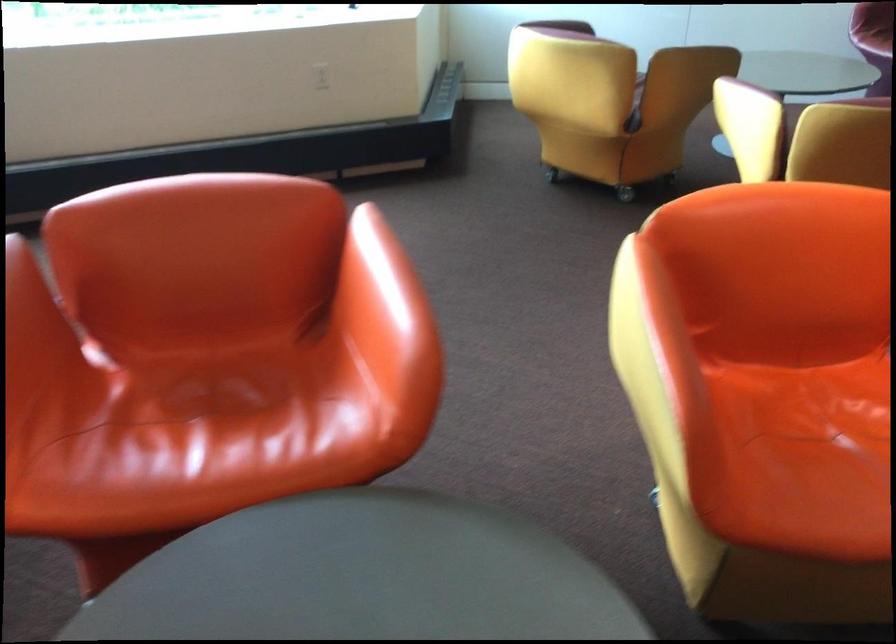
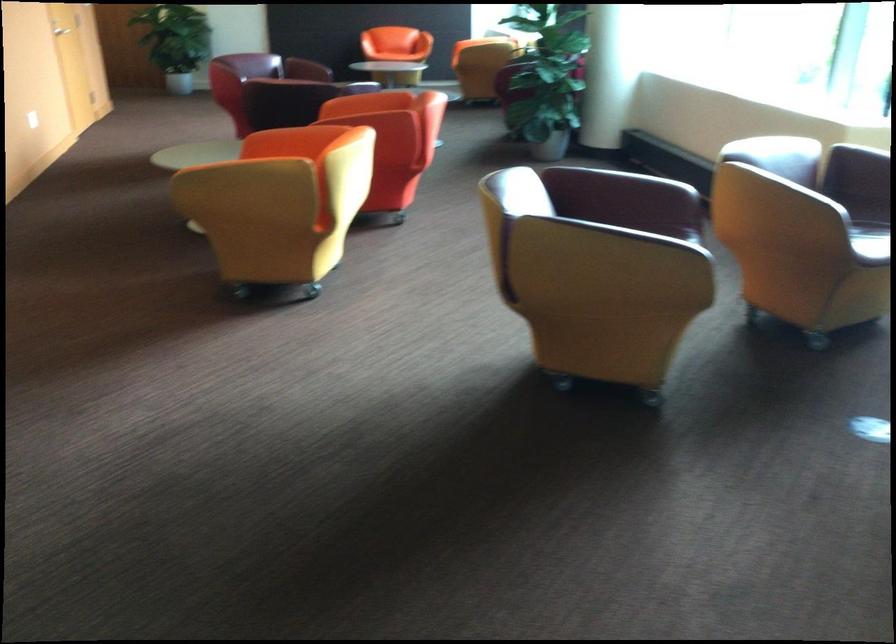
Question: I am providing you with two images of the same scene from different viewpoints. Which of the following objects are not visible in image2?

Choices:
 (A) wooden kitchen utensil
 (B) yellow chair armrest
 (C) orange chair sitting surface
 (D) red chair armrest

Answer: (C)